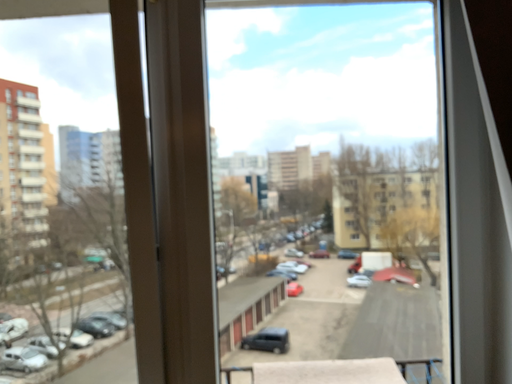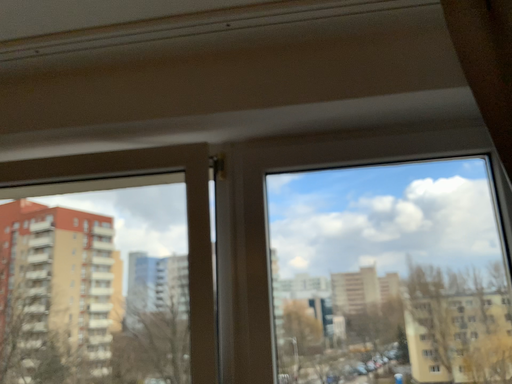
Question: Which way did the camera rotate in the video?

Choices:
 (A) rotated right
 (B) rotated left

Answer: (B)